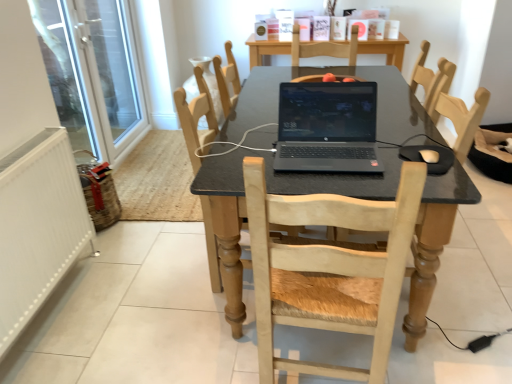
The image size is (512, 384). What are the coordinates of `vacant space underneath white textured radiator at left (from a real-world perspective)` in the screenshot? It's located at (53, 316).